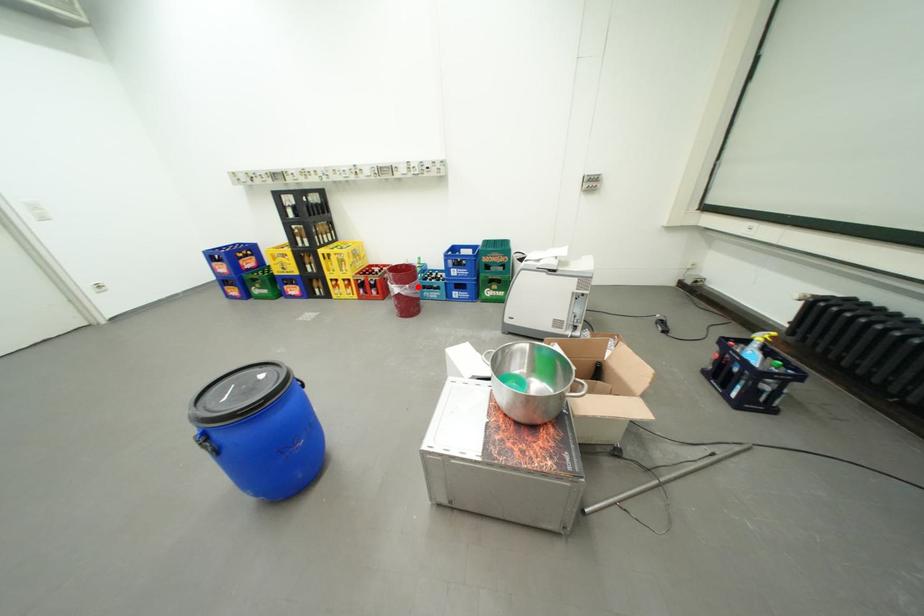
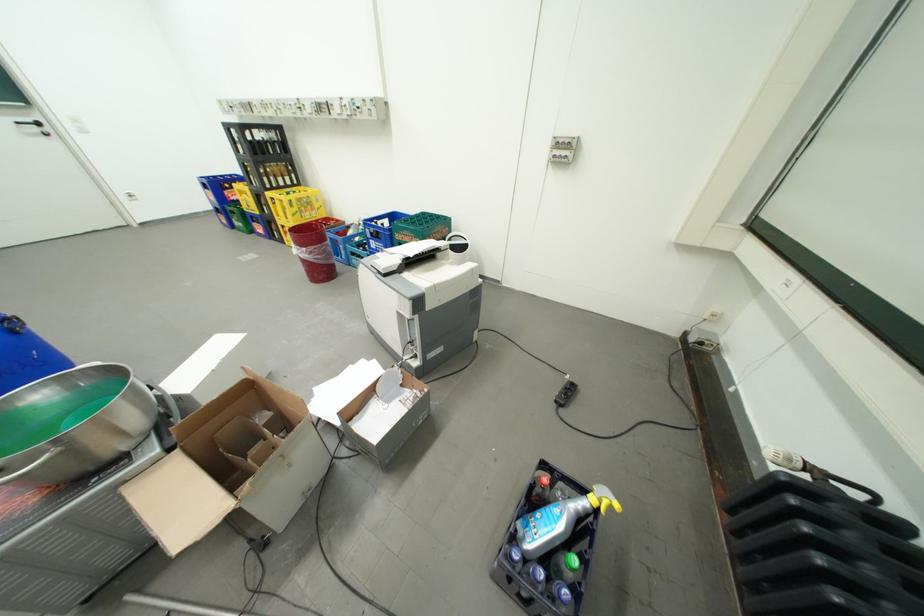
Where in the second image is the point corresponding to the highlighted location from the first image?

(314, 249)